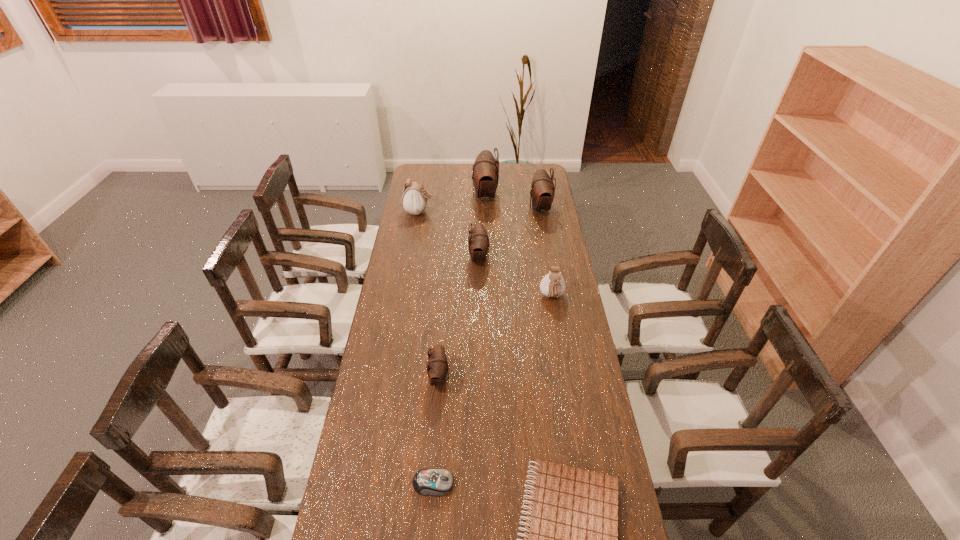
I want to click on free space between the tallest object and the sixth farthest object, so click(462, 286).

Identify the location of free point between the computer mouse and the fourth farthest pouch. This screenshot has height=540, width=960. (456, 370).

At what (x,y) coordinates should I click in order to perform the action: click on vacant space in between the tallest pouch and the right white pouch. Please return your answer as a coordinate pair (x, y). Image resolution: width=960 pixels, height=540 pixels. Looking at the image, I should click on (518, 246).

Locate an element on the screen. The image size is (960, 540). free space between the third farthest brown pouch and the rightmost brown pouch is located at coordinates (510, 233).

The image size is (960, 540). In order to click on vacant area between the fifth pouch from right to left and the rightmost brown pouch in this screenshot , I will do `click(490, 293)`.

Locate which object ranks fourth in proximity to the leftmost brown pouch. Please provide its 2D coordinates. Your answer should be formatted as a tuple, i.e. [(x, y)], where the tuple contains the x and y coordinates of a point satisfying the conditions above.

[(478, 241)]

Locate which object is the second closest to the third smallest brown pouch. Please provide its 2D coordinates. Your answer should be formatted as a tuple, i.e. [(x, y)], where the tuple contains the x and y coordinates of a point satisfying the conditions above.

[(478, 241)]

Identify which pouch is located as the second nearest to the tallest object. Please provide its 2D coordinates. Your answer should be formatted as a tuple, i.e. [(x, y)], where the tuple contains the x and y coordinates of a point satisfying the conditions above.

[(414, 200)]

This screenshot has height=540, width=960. I want to click on pouch object that ranks as the third closest to the leftmost object, so click(542, 191).

Locate an element on the screen. Image resolution: width=960 pixels, height=540 pixels. brown pouch that is the fourth nearest to the nearer white pouch is located at coordinates (485, 175).